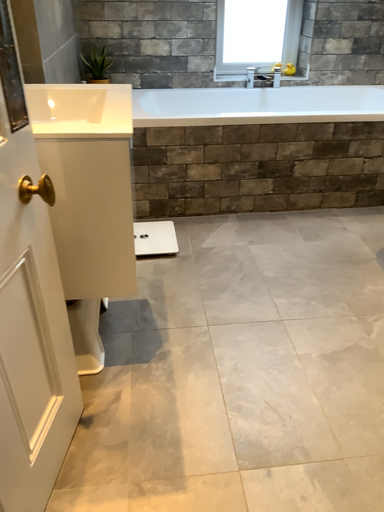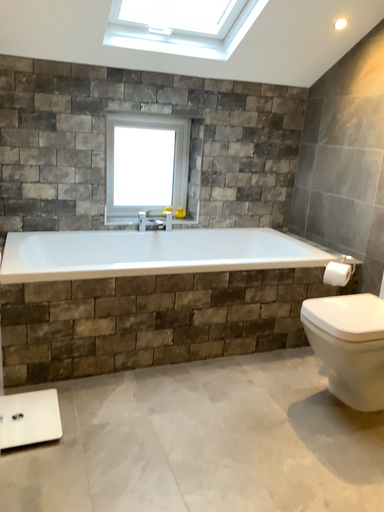
Question: Which way did the camera rotate in the video?

Choices:
 (A) rotated left
 (B) rotated right

Answer: (B)